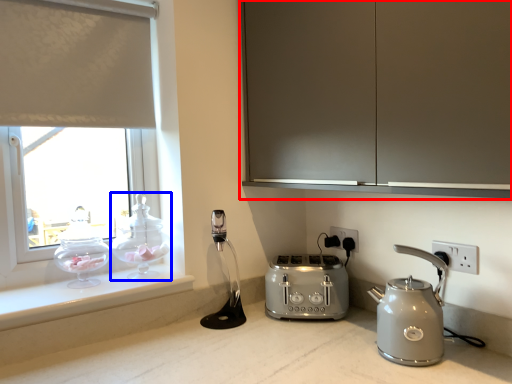
Question: Which object appears closest to the camera in this image, cabinetry (highlighted by a red box) or tea pot (highlighted by a blue box)?

Choices:
 (A) cabinetry
 (B) tea pot

Answer: (A)